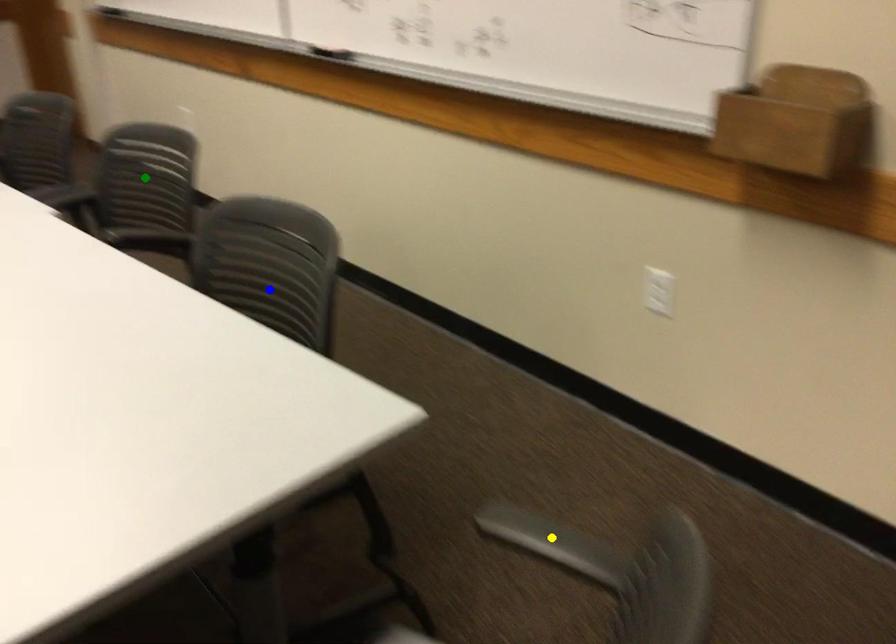
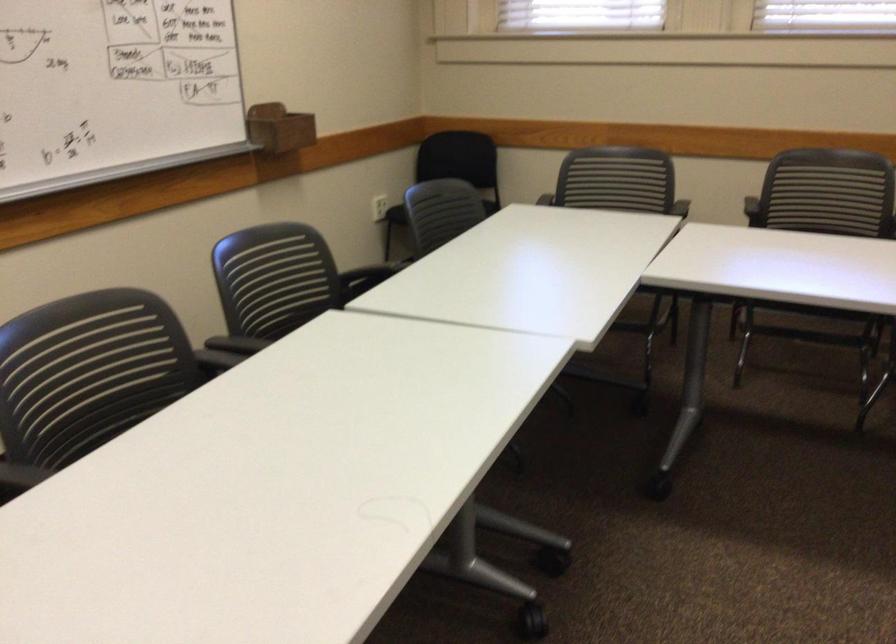
I am providing you with two images of the same scene from different viewpoints. Three points are marked in image1. Which point corresponds to a part or object that is occluded in image2?In image1, three points are marked. Which of them correspond to a part or object that is occluded in image2?Among the three points shown in image1, which one corresponds to a part or object that is no longer visible due to occlusion in image2?

green point, yellow point, blue point